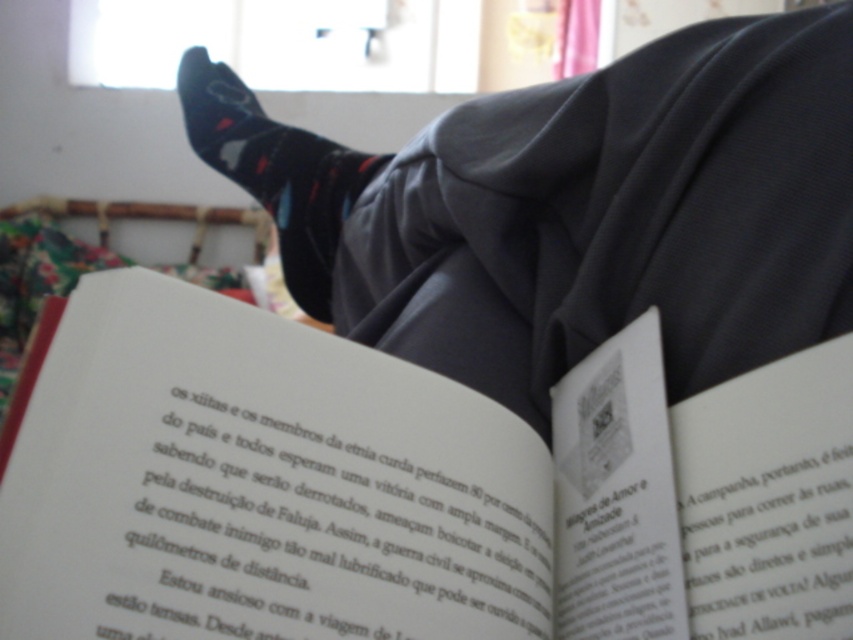
Question: Does white paper at upper center appear on the left side of black matte socks at upper center?

Choices:
 (A) no
 (B) yes

Answer: (A)

Question: Can you confirm if white paper at upper center is positioned to the right of black matte socks at upper center?

Choices:
 (A) no
 (B) yes

Answer: (B)

Question: Is white paper at upper center below black matte socks at upper center?

Choices:
 (A) yes
 (B) no

Answer: (A)

Question: Among these points, which one is nearest to the camera?

Choices:
 (A) [701, 122]
 (B) [238, 131]

Answer: (A)

Question: Which point is closer to the camera?

Choices:
 (A) white paper at upper center
 (B) black matte socks at upper center

Answer: (A)

Question: Which point is farther to the camera?

Choices:
 (A) black matte socks at upper center
 (B) multicolored socks at upper center
 (C) white paper at upper center

Answer: (A)